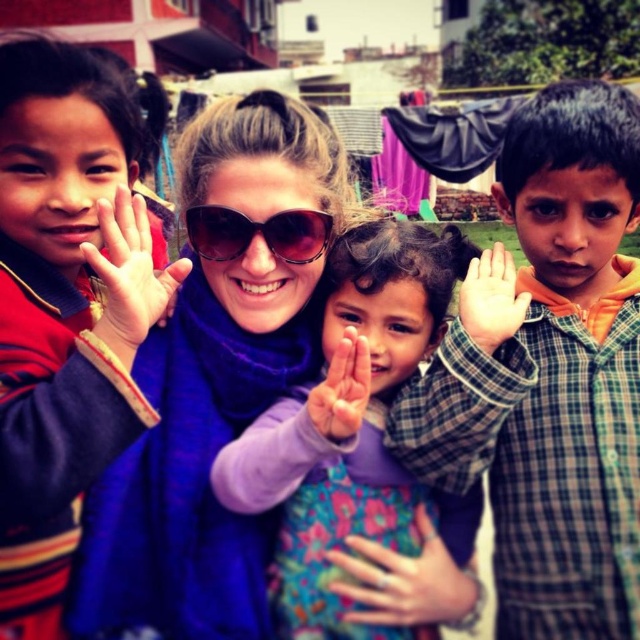
Question: Can you confirm if checkered fabric shirt at right is positioned to the right of pink fabric hand at center?

Choices:
 (A) yes
 (B) no

Answer: (A)

Question: Observing the image, what is the correct spatial positioning of matte purple scarf at center in reference to light skin palm at center?

Choices:
 (A) above
 (B) below

Answer: (A)

Question: Which is farther from the purple scarf at center?

Choices:
 (A) red plaid shirt at left
 (B) matte purple scarf at center

Answer: (B)

Question: Which point appears closest to the camera in this image?

Choices:
 (A) (296, 477)
 (B) (241, 227)
 (C) (164, 337)

Answer: (A)

Question: Is the position of checkered fabric shirt at right more distant than that of red plaid shirt at left?

Choices:
 (A) no
 (B) yes

Answer: (B)

Question: Which of the following is the farthest from the observer?

Choices:
 (A) red plaid shirt at left
 (B) floral dress at center

Answer: (B)